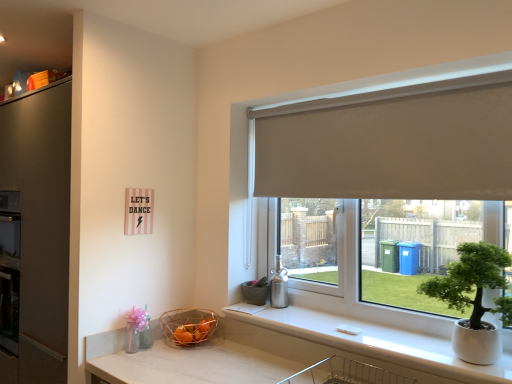
Question: Is white glossy counter top at lower right taller than white fabric roller blind at upper center?

Choices:
 (A) yes
 (B) no

Answer: (B)

Question: Is white glossy counter top at lower right to the right of white fabric roller blind at upper center from the viewer's perspective?

Choices:
 (A) no
 (B) yes

Answer: (A)

Question: Is white glossy counter top at lower right thinner than white fabric roller blind at upper center?

Choices:
 (A) yes
 (B) no

Answer: (B)

Question: Would you say white glossy counter top at lower right is outside white fabric roller blind at upper center?

Choices:
 (A) yes
 (B) no

Answer: (A)

Question: Is white glossy counter top at lower right closer to camera compared to white fabric roller blind at upper center?

Choices:
 (A) yes
 (B) no

Answer: (A)

Question: Is green matte houseplant at right situated inside white glossy counter top at lower right or outside?

Choices:
 (A) outside
 (B) inside

Answer: (A)

Question: Considering the relative positions of green matte houseplant at right and white glossy counter top at lower right in the image provided, is green matte houseplant at right to the left or to the right of white glossy counter top at lower right?

Choices:
 (A) left
 (B) right

Answer: (B)

Question: Looking at the image, does green matte houseplant at right seem bigger or smaller compared to white glossy counter top at lower right?

Choices:
 (A) small
 (B) big

Answer: (B)

Question: In the image, is green matte houseplant at right positioned in front of or behind white glossy counter top at lower right?

Choices:
 (A) behind
 (B) front

Answer: (B)

Question: From a real-world perspective, is white fabric roller blind at upper center above or below white glossy counter top at lower right?

Choices:
 (A) below
 (B) above

Answer: (B)

Question: Relative to white glossy counter top at lower right, is white fabric roller blind at upper center in front or behind?

Choices:
 (A) front
 (B) behind

Answer: (B)

Question: Would you say white fabric roller blind at upper center is to the left or to the right of white glossy counter top at lower right in the picture?

Choices:
 (A) right
 (B) left

Answer: (A)

Question: From the image's perspective, is white fabric roller blind at upper center located above or below white glossy counter top at lower right?

Choices:
 (A) above
 (B) below

Answer: (A)

Question: Is white fabric roller blind at upper center spatially inside copper wire basket at lower center, or outside of it?

Choices:
 (A) outside
 (B) inside

Answer: (A)

Question: From a real-world perspective, relative to copper wire basket at lower center, is white fabric roller blind at upper center vertically above or below?

Choices:
 (A) below
 (B) above

Answer: (B)